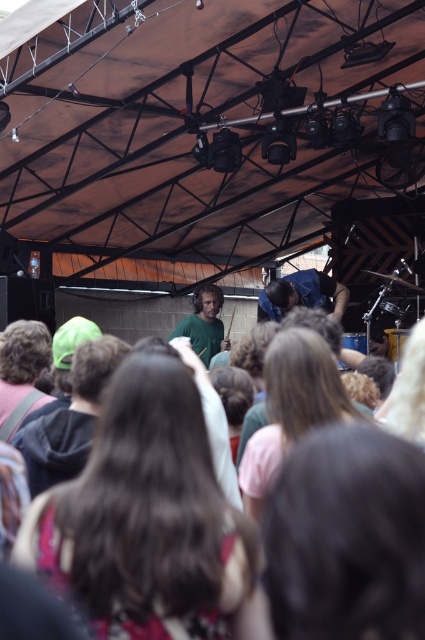
You are a photographer at the music event and want to take a photo of both the brown hair at center and the blue fabric shirt at center. To ensure both are in frame, should you position yourself to the left or right side of the stage?

You should position yourself to the right side of the stage. Since the brown hair at center is to the left of the blue fabric shirt at center, placing yourself to the right would allow both objects to be captured within the frame.

You are standing at the entrance of the tent and want to take a photo of both the brown hair at center and the blue fabric shirt at center in the same frame. The camera you have can focus on objects up to 10 meters away. Will both subjects be in focus?

The brown hair at center is 8.21 meters away from the blue fabric shirt at center. Since the maximum distance the camera can focus is 10 meters, both subjects will be within the focus range and can be captured in the same frame.

You are at the point marked as point (345, 540) in the image. What can you see at that location?

At point (345, 540), you can see brown hair at center.